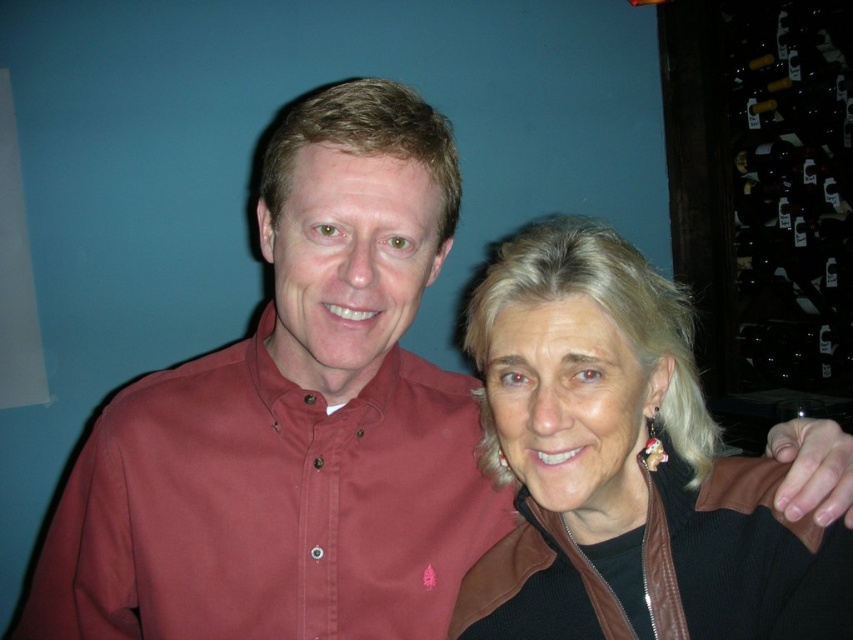
You are a photographer setting up a camera to capture a group shot of the two people in the scene. You need to adjust the focus so that both the burgundy cotton shirt at center and the black leather jacket at upper right are in clear view. Which clothing item should you focus on first to ensure proper depth of field?

The photographer should focus on the burgundy cotton shirt at center first because it is shorter than the black leather jacket at upper right, allowing the depth of field to cover both subjects effectively.

You are a photographer adjusting your camera settings. You want to focus on the burgundy cotton shirt at center. Given that your camera can only focus on objects within a 0.2 unit radius around the center point, will the shirt be in focus?

The burgundy cotton shirt at center is located at point (268, 508), which is outside the 0.2 unit radius from the center. Therefore, the shirt will not be in focus.

You are a photographer trying to place a small prop at the exact coordinates of point (268,508). According to the scene, where should you place the prop?

The point (268,508) is on the burgundy cotton shirt at center, so you should place the prop on the burgundy cotton shirt at center.